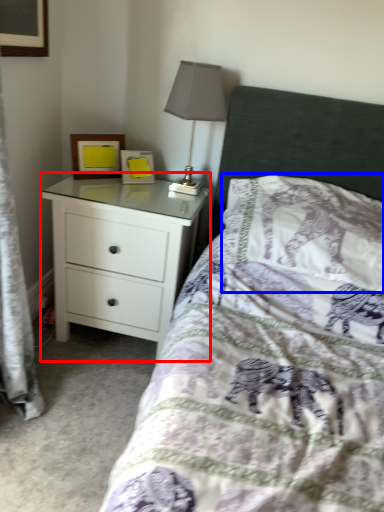
Question: Which of the following is the closest to the observer, chest of drawers (highlighted by a red box) or pillow (highlighted by a blue box)?

Choices:
 (A) chest of drawers
 (B) pillow

Answer: (B)